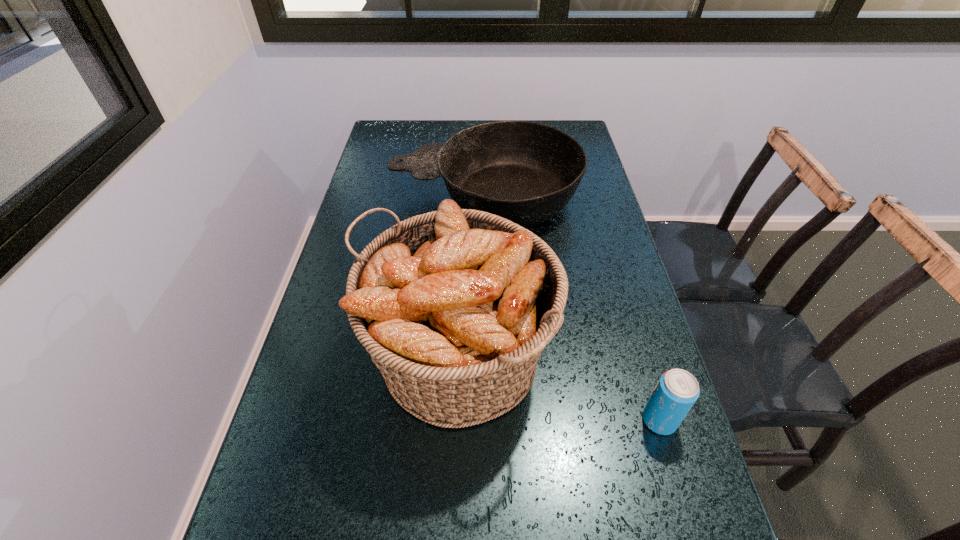
At what (x,y) coordinates should I click in order to perform the action: click on frying pan that is at the right edge. Please return your answer as a coordinate pair (x, y). This screenshot has width=960, height=540. Looking at the image, I should click on (525, 172).

At what (x,y) coordinates should I click in order to perform the action: click on soda can that is at the right edge. Please return your answer as a coordinate pair (x, y). Image resolution: width=960 pixels, height=540 pixels. Looking at the image, I should click on (677, 390).

At what (x,y) coordinates should I click in order to perform the action: click on vacant region at the left edge of the desktop. Please return your answer as a coordinate pair (x, y). This screenshot has height=540, width=960. Looking at the image, I should click on (327, 307).

Locate an element on the screen. Image resolution: width=960 pixels, height=540 pixels. blank area at the right edge is located at coordinates (630, 437).

Where is `vacant space at the far left corner`? vacant space at the far left corner is located at coordinates (400, 152).

The width and height of the screenshot is (960, 540). Find the location of `empty space that is in between the rightmost object and the tallest object`. empty space that is in between the rightmost object and the tallest object is located at coordinates (560, 389).

Locate an element on the screen. Image resolution: width=960 pixels, height=540 pixels. vacant area that lies between the soda can and the frying pan is located at coordinates (572, 308).

What are the coordinates of `unoccupied position between the basket and the rightmost object` in the screenshot? It's located at (560, 389).

Locate which object is the closest to the tallest object. Please provide its 2D coordinates. Your answer should be formatted as a tuple, i.e. [(x, y)], where the tuple contains the x and y coordinates of a point satisfying the conditions above.

[(677, 390)]

Identify which object is the second nearest to the rightmost object. Please provide its 2D coordinates. Your answer should be formatted as a tuple, i.e. [(x, y)], where the tuple contains the x and y coordinates of a point satisfying the conditions above.

[(525, 172)]